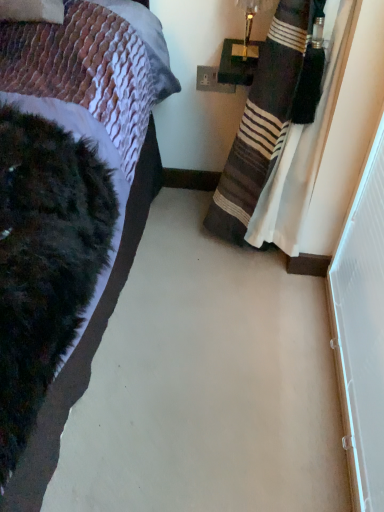
Where is `free region under striped fabric curtain at right (from a real-world perspective)`? free region under striped fabric curtain at right (from a real-world perspective) is located at coordinates coord(243,269).